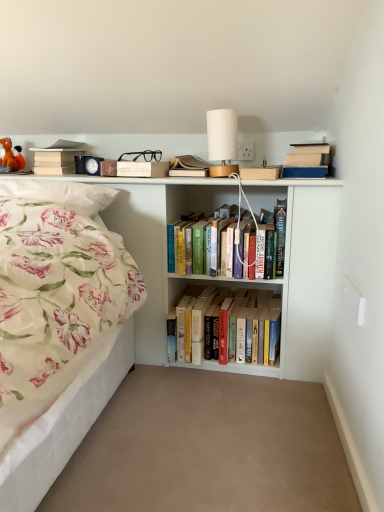
Describe the element at coordinates (306, 270) in the screenshot. I see `white matte bookcase at upper center` at that location.

Image resolution: width=384 pixels, height=512 pixels. Describe the element at coordinates (208, 447) in the screenshot. I see `beige carpet at center` at that location.

Consider the image. In order to face matte brown book at upper center, should I rotate leftwards or rightwards?

A 7.619 degree turn to the left will do.

What do you see at coordinates (134, 169) in the screenshot? I see `matte brown book at upper center` at bounding box center [134, 169].

What do you see at coordinates (61, 193) in the screenshot? The width and height of the screenshot is (384, 512). I see `floral fabric pillow at left` at bounding box center [61, 193].

What do you see at coordinates (12, 155) in the screenshot? The width and height of the screenshot is (384, 512). I see `orange plush toy at upper left` at bounding box center [12, 155].

Locate an element on the screen. This screenshot has width=384, height=512. white matte bookcase at upper center is located at coordinates (306, 270).

Between hardcover books at center, which is the 2th book in bottom-to-top order, and white matte bookcase at upper center, which one has more height?

white matte bookcase at upper center.

Looking at their sizes, would you say hardcover books at center, the first book in the right-to-left sequence, is wider or thinner than white matte bookcase at upper center?

hardcover books at center, the first book in the right-to-left sequence, is wider than white matte bookcase at upper center.

Which object is positioned more to the left, hardcover books at center, which ranks as the 3th book in left-to-right order, or white matte bookcase at upper center?

white matte bookcase at upper center.

Is white matte bookcase at upper center far away from beige matte book at upper left, the 3th book from the bottom?

No.

From the image's perspective, is white matte bookcase at upper center positioned above or below beige matte book at upper left, the 3th book from the bottom?

white matte bookcase at upper center is situated lower than beige matte book at upper left, the 3th book from the bottom, in the image.

Does white matte bookcase at upper center have a lesser width compared to beige matte book at upper left, which is the first book from top to bottom?

Incorrect, the width of white matte bookcase at upper center is not less than that of beige matte book at upper left, which is the first book from top to bottom.

Considering the positions of objects matte brown book at upper center and hardcover books at center, which is counted as the second book, starting from the left, in the image provided, who is behind, matte brown book at upper center or hardcover books at center, which is counted as the second book, starting from the left,?

hardcover books at center, which is counted as the second book, starting from the left, is further away from the camera.

From the image's perspective, is matte brown book at upper center located above hardcover books at center, positioned as the 2th book in right-to-left order?

Yes.

Is matte brown book at upper center touching hardcover books at center, which is counted as the second book, starting from the left?

matte brown book at upper center is not next to hardcover books at center, which is counted as the second book, starting from the left, and they're not touching.

Could you tell me if matte brown book at upper center is turned towards hardcover books at center, positioned as the 1th book in bottom-to-top order?

No, matte brown book at upper center does not turn towards hardcover books at center, positioned as the 1th book in bottom-to-top order.

Considering the positions of objects matte brown book at upper center and hardcover books at center, the first book in the right-to-left sequence, in the image provided, who is more to the right, matte brown book at upper center or hardcover books at center, the first book in the right-to-left sequence,?

From the viewer's perspective, hardcover books at center, the first book in the right-to-left sequence, appears more on the right side.

Considering the sizes of objects matte brown book at upper center and hardcover books at center, which ranks as the 3th book in left-to-right order, in the image provided, who is smaller, matte brown book at upper center or hardcover books at center, which ranks as the 3th book in left-to-right order,?

Smaller between the two is matte brown book at upper center.

Looking at this image, is hardcover books at center, the first book in the right-to-left sequence, at the back of matte brown book at upper center?

matte brown book at upper center is not turned away from hardcover books at center, the first book in the right-to-left sequence.

Which of these two, matte brown book at upper center or hardcover books at center, which is the 2th book in bottom-to-top order, is thinner?

matte brown book at upper center.

Is the position of white matte table lamp at upper center more distant than that of beige matte book at upper left, which appears as the 3th book when viewed from the right?

No, white matte table lamp at upper center is closer to the camera.

Considering the sizes of objects white matte table lamp at upper center and beige matte book at upper left, which appears as the 3th book when viewed from the right, in the image provided, who is smaller, white matte table lamp at upper center or beige matte book at upper left, which appears as the 3th book when viewed from the right,?

white matte table lamp at upper center.

Is white matte table lamp at upper center not near beige matte book at upper left, which is counted as the 1th book, starting from the left?

They are positioned close to each other.

Consider the image. Which point is more distant from viewer, (207, 130) or (54, 149)?

The point (54, 149) is farther from the camera.

Is white matte bookcase at upper center aimed at orange plush toy at upper left?

No, white matte bookcase at upper center does not turn towards orange plush toy at upper left.

Can you confirm if white matte bookcase at upper center is positioned to the right of orange plush toy at upper left?

Yes.

From a real-world perspective, is white matte bookcase at upper center above or below orange plush toy at upper left?

white matte bookcase at upper center is situated lower than orange plush toy at upper left in the real world.

Is point (214, 188) more distant than point (2, 142)?

Yes, point (214, 188) is behind point (2, 142).

Considering the positions of objects matte brown book at upper center and beige matte book at upper left, which is counted as the 1th book, starting from the left, in the image provided, who is behind, matte brown book at upper center or beige matte book at upper left, which is counted as the 1th book, starting from the left,?

beige matte book at upper left, which is counted as the 1th book, starting from the left, is further from the camera.

Is beige matte book at upper left, the 3th book from the bottom, at the back of matte brown book at upper center?

matte brown book at upper center is not turned away from beige matte book at upper left, the 3th book from the bottom.

Which of these two, matte brown book at upper center or beige matte book at upper left, the 3th book from the bottom, stands taller?

Standing taller between the two is beige matte book at upper left, the 3th book from the bottom.

How distant is matte brown book at upper center from beige matte book at upper left, which is counted as the 1th book, starting from the left?

matte brown book at upper center and beige matte book at upper left, which is counted as the 1th book, starting from the left, are 12.05 inches apart from each other.

Identify the location of the 1st book above the white matte bookcase at upper center (from the image's perspective). (197, 245).

Image resolution: width=384 pixels, height=512 pixels. I want to click on book on the left of white matte bookcase at upper center, so click(57, 158).

Which object lies nearer to the anchor point floral fabric pillow at left, white matte bookcase at upper center or white matte table lamp at upper center?

Based on the image, white matte bookcase at upper center appears to be nearer to floral fabric pillow at left.

From the picture: Considering their positions, is beige matte book at upper left, which is the first book from top to bottom, positioned closer to floral fabric pillow at left than beige carpet at center?

beige matte book at upper left, which is the first book from top to bottom, lies closer to floral fabric pillow at left than the other object.

Considering their positions, is floral fabric pillow at left positioned closer to hardcover books at center, which is counted as the second book, starting from the left, than white matte bookcase at upper center?

white matte bookcase at upper center.

Considering their positions, is white matte bookcase at upper center positioned further to floral fabric pillow at left than beige carpet at center?

beige carpet at center.

Based on the photo, estimate the real-world distances between objects in this image. Which object is closer to hardcover books at center, which is the 2th book in bottom-to-top order, matte brown book at upper center or beige carpet at center?

Based on the image, matte brown book at upper center appears to be nearer to hardcover books at center, which is the 2th book in bottom-to-top order.

Based on their spatial positions, is matte brown book at upper center or hardcover books at center, which ranks as the third book in top-to-bottom order, further from hardcover books at center, which ranks as the 3th book in left-to-right order?

matte brown book at upper center.

Which object lies nearer to the anchor point white matte bookcase at upper center, hardcover books at center, the 2th book in the top-to-bottom sequence, or white matte table lamp at upper center?

The object closer to white matte bookcase at upper center is hardcover books at center, the 2th book in the top-to-bottom sequence.

When comparing their distances from hardcover books at center, the first book in the right-to-left sequence, does white matte table lamp at upper center or beige carpet at center seem closer?

white matte table lamp at upper center is positioned closer to the anchor hardcover books at center, the first book in the right-to-left sequence.

Identify the location of book located between beige carpet at center and hardcover books at center, which ranks as the third book in top-to-bottom order, in the depth direction. The width and height of the screenshot is (384, 512). (197, 245).

What are the coordinates of `pillow located between orange plush toy at upper left and white matte bookcase at upper center in the left-right direction` in the screenshot? It's located at (61, 193).

Find the location of a particular element. plain between orange plush toy at upper left and hardcover books at center, which is the 2th book in bottom-to-top order, in the horizontal direction is located at coordinates (208, 447).

Find the location of a particular element. The width and height of the screenshot is (384, 512). book between beige matte book at upper left, which is the first book from top to bottom, and hardcover books at center, which is the 2th book in bottom-to-top order is located at coordinates click(232, 326).